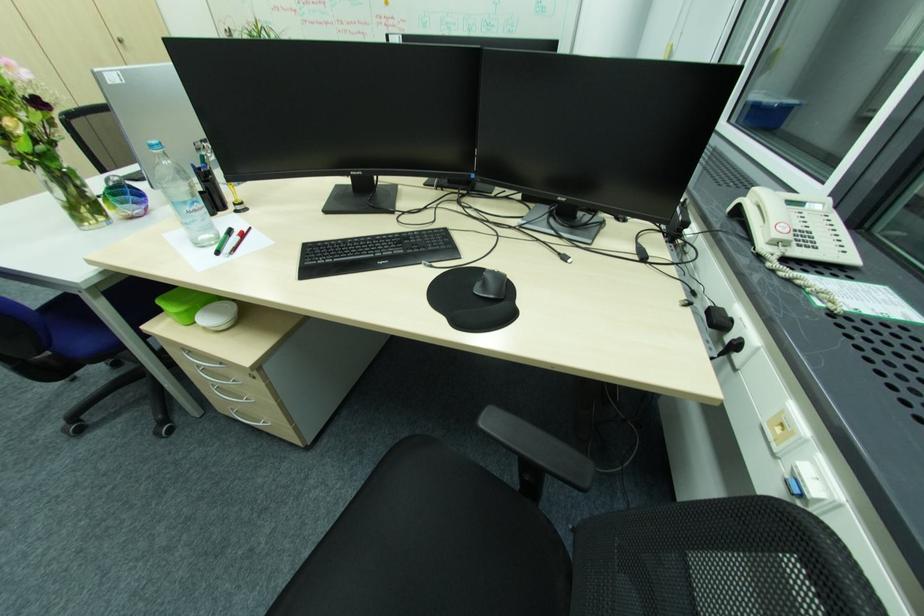
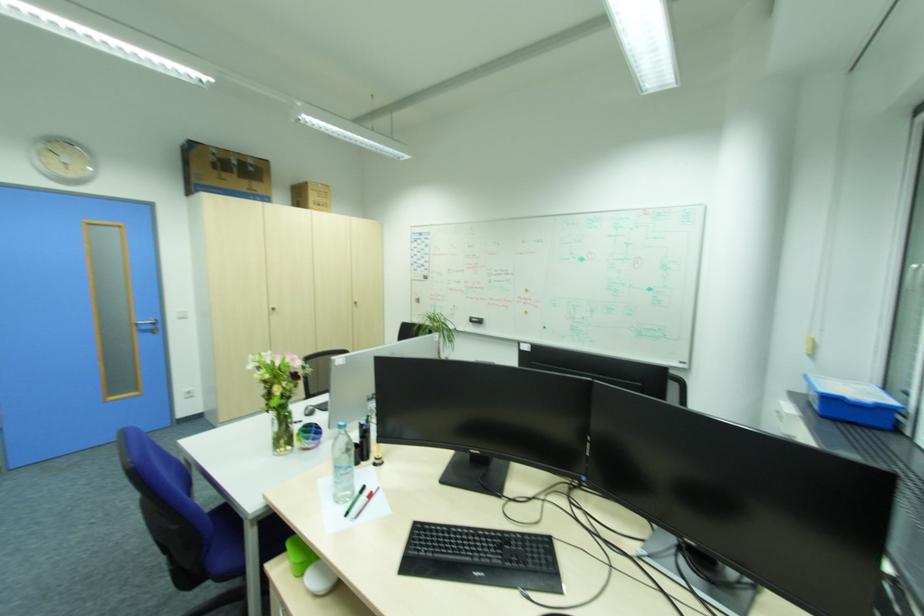
How did the camera likely rotate?

The rotation direction of the camera is left-up.